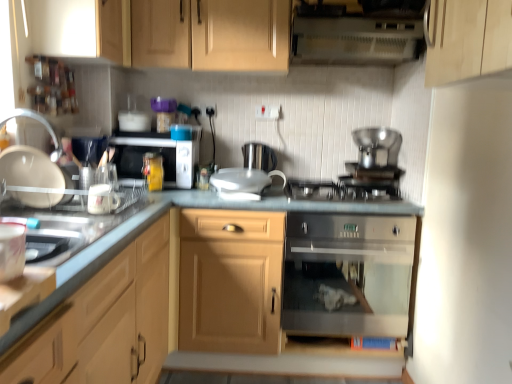
Question: Can we say wooden cabinet at upper center, which is counted as the first cabinetry, starting from the top, lies outside light wood cabinet at upper left, the third cabinetry ordered from the bottom?

Choices:
 (A) no
 (B) yes

Answer: (B)

Question: Is wooden cabinet at upper center, marked as the fourth cabinetry in a bottom-to-top arrangement, positioned before light wood cabinet at upper left, which is the second cabinetry in top-to-bottom order?

Choices:
 (A) no
 (B) yes

Answer: (B)

Question: From a real-world perspective, is wooden cabinet at upper center, which is counted as the first cabinetry, starting from the top, beneath light wood cabinet at upper left, which is the second cabinetry in top-to-bottom order?

Choices:
 (A) no
 (B) yes

Answer: (A)

Question: Is wooden cabinet at upper center, which is counted as the first cabinetry, starting from the top, further to the viewer compared to light wood cabinet at upper left, the third cabinetry ordered from the bottom?

Choices:
 (A) no
 (B) yes

Answer: (A)

Question: From the image's perspective, is wooden cabinet at upper center, which is counted as the first cabinetry, starting from the top, under light wood cabinet at upper left, which is the second cabinetry in top-to-bottom order?

Choices:
 (A) yes
 (B) no

Answer: (B)

Question: From the image's perspective, is white plastic vent at upper center located above or below matte black microwave at center?

Choices:
 (A) below
 (B) above

Answer: (B)

Question: Considering the relative positions of white plastic vent at upper center and matte black microwave at center in the image provided, is white plastic vent at upper center to the left or to the right of matte black microwave at center?

Choices:
 (A) left
 (B) right

Answer: (B)

Question: Is white plastic vent at upper center wider or thinner than matte black microwave at center?

Choices:
 (A) thin
 (B) wide

Answer: (B)

Question: Would you say white plastic vent at upper center is inside or outside matte black microwave at center?

Choices:
 (A) outside
 (B) inside

Answer: (A)

Question: Is white glossy mug at left, the 1th appliance when ordered from left to right, taller or shorter than stainless steel oven at center?

Choices:
 (A) short
 (B) tall

Answer: (A)

Question: Considering their positions, is white glossy mug at left, the 1th appliance when ordered from left to right, located in front of or behind stainless steel oven at center?

Choices:
 (A) behind
 (B) front

Answer: (B)

Question: Considering the positions of white glossy mug at left, the 2th appliance when ordered from front to back, and stainless steel oven at center in the image, is white glossy mug at left, the 2th appliance when ordered from front to back, bigger or smaller than stainless steel oven at center?

Choices:
 (A) small
 (B) big

Answer: (A)

Question: Considering the positions of white glossy mug at left, the 1th appliance when ordered from left to right, and stainless steel oven at center in the image, is white glossy mug at left, the 1th appliance when ordered from left to right, wider or thinner than stainless steel oven at center?

Choices:
 (A) thin
 (B) wide

Answer: (A)

Question: Looking at their shapes, would you say wooden cabinet at upper center, marked as the fourth cabinetry in a bottom-to-top arrangement, is wider or thinner than white plastic vent at upper center?

Choices:
 (A) wide
 (B) thin

Answer: (A)

Question: Is wooden cabinet at upper center, marked as the fourth cabinetry in a bottom-to-top arrangement, taller or shorter than white plastic vent at upper center?

Choices:
 (A) short
 (B) tall

Answer: (B)